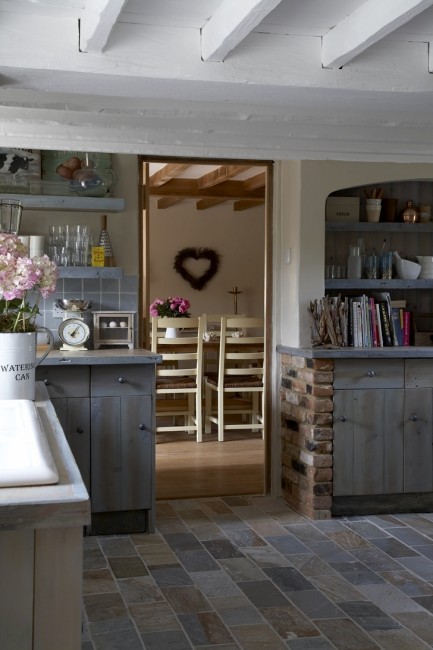
Find the location of a particular element. This screenshot has width=433, height=650. white chair is located at coordinates (233, 370).